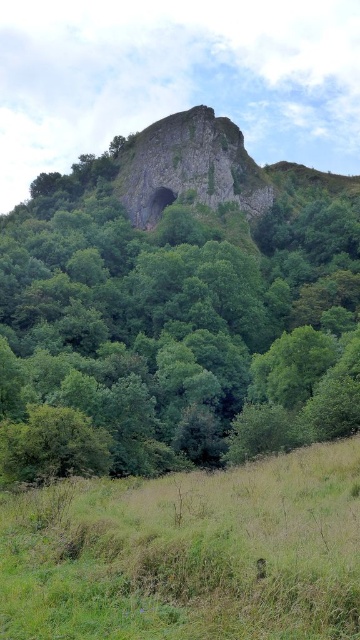
Question: Which of these objects is positioned closest to the green leafy tree at center?

Choices:
 (A) green grassy field at lower center
 (B) rusty stone rock at center

Answer: (B)

Question: Can you confirm if green leafy tree at center is positioned to the left of rusty stone rock at center?

Choices:
 (A) yes
 (B) no

Answer: (A)

Question: Which point appears farthest from the camera in this image?

Choices:
 (A) (159, 166)
 (B) (272, 614)

Answer: (A)

Question: Does green leafy tree at center have a smaller size compared to rusty stone rock at center?

Choices:
 (A) no
 (B) yes

Answer: (A)

Question: Is green leafy tree at center below rusty stone rock at center?

Choices:
 (A) no
 (B) yes

Answer: (B)

Question: Which of the following is the farthest from the observer?

Choices:
 (A) green grassy field at lower center
 (B) rusty stone rock at center
 (C) green leafy tree at center

Answer: (B)